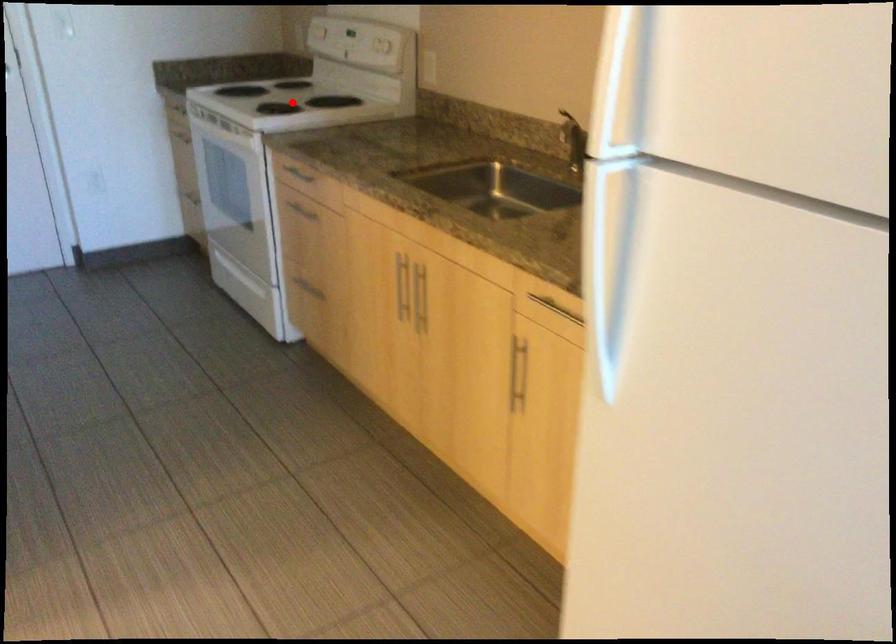
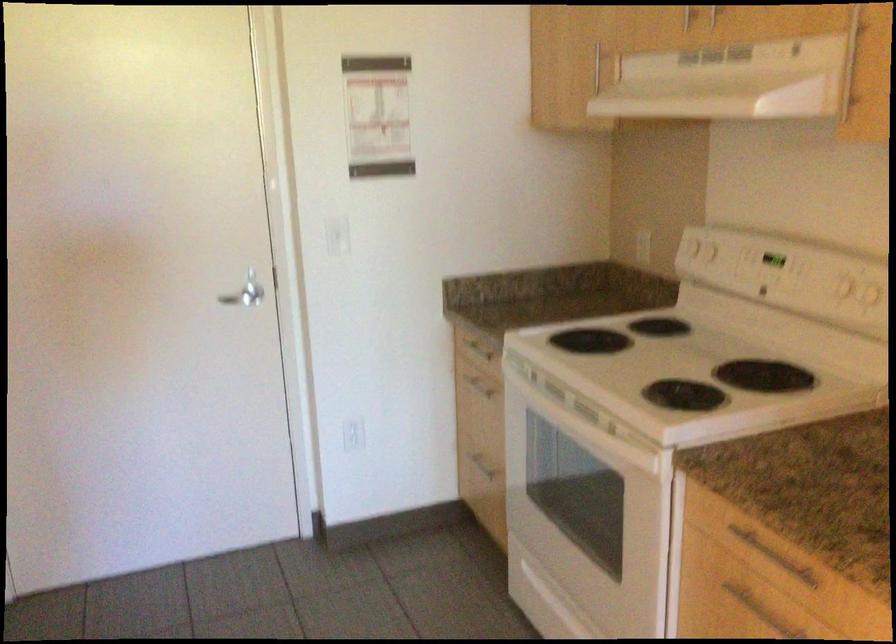
Find the pixel in the second image that matches the highlighted location in the first image.

(686, 365)